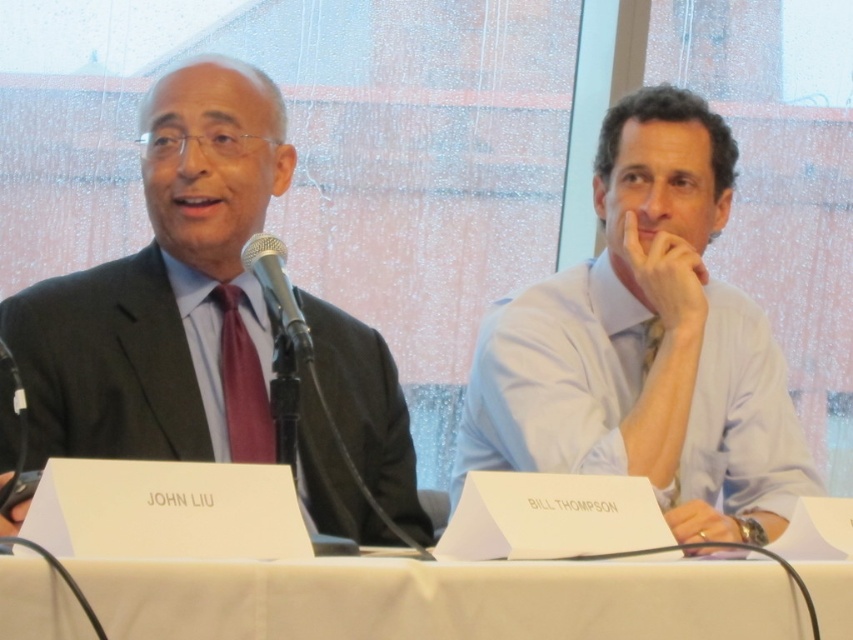
Question: Can you confirm if matte black suit at left is thinner than light blue shirt at right?

Choices:
 (A) yes
 (B) no

Answer: (B)

Question: Which object appears farthest from the camera in this image?

Choices:
 (A) matte red tie at left
 (B) white paper at center
 (C) light blue shirt at right
 (D) matte black suit at left

Answer: (A)

Question: Can you confirm if light blue shirt at right is bigger than metallic silver microphone at center?

Choices:
 (A) yes
 (B) no

Answer: (A)

Question: Estimate the real-world distances between objects in this image. Which object is closer to the matte red tie at left?

Choices:
 (A) matte black suit at left
 (B) white paper at center
 (C) light blue shirt at right

Answer: (A)

Question: Which point is farther to the camera?

Choices:
 (A) (88, 563)
 (B) (248, 272)
 (C) (228, 337)
 (D) (231, 355)

Answer: (C)

Question: Is matte black suit at left below matte red tie at left?

Choices:
 (A) yes
 (B) no

Answer: (B)